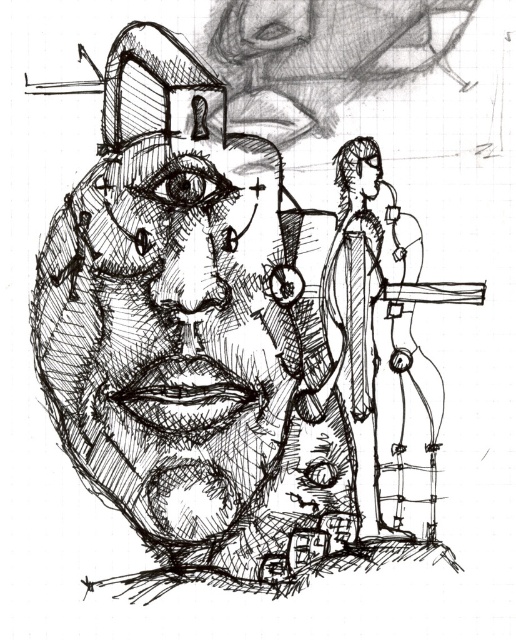
Can you confirm if black ink drawing of face at center is positioned below smooth black head at upper right?

Indeed, black ink drawing of face at center is positioned under smooth black head at upper right.

Is black ink drawing of face at center to the right of smooth black head at upper right from the viewer's perspective?

No, black ink drawing of face at center is not to the right of smooth black head at upper right.

Is point (120, 346) positioned after point (358, 141)?

No, (120, 346) is closer to viewer.

Locate an element on the screen. The height and width of the screenshot is (640, 516). black ink drawing of face at center is located at coordinates (162, 344).